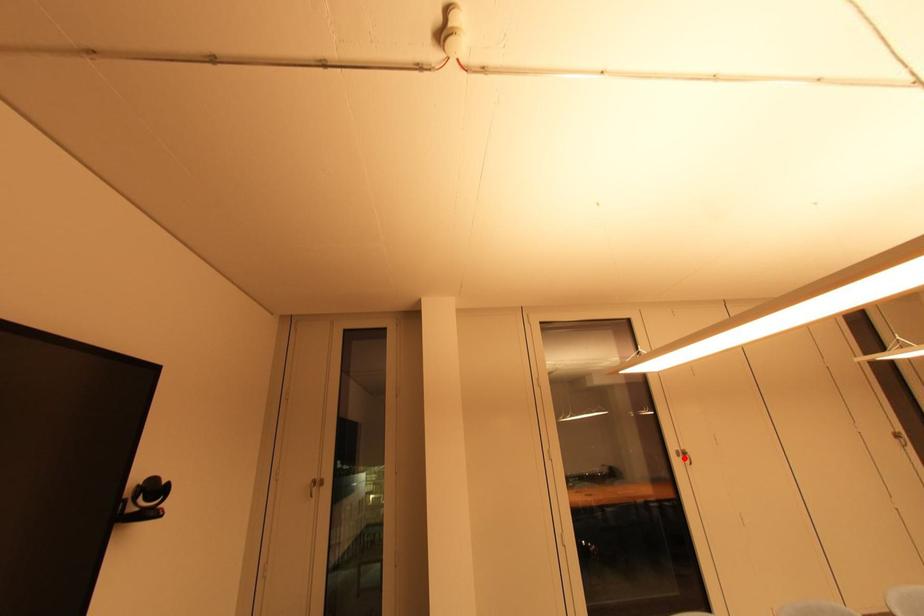
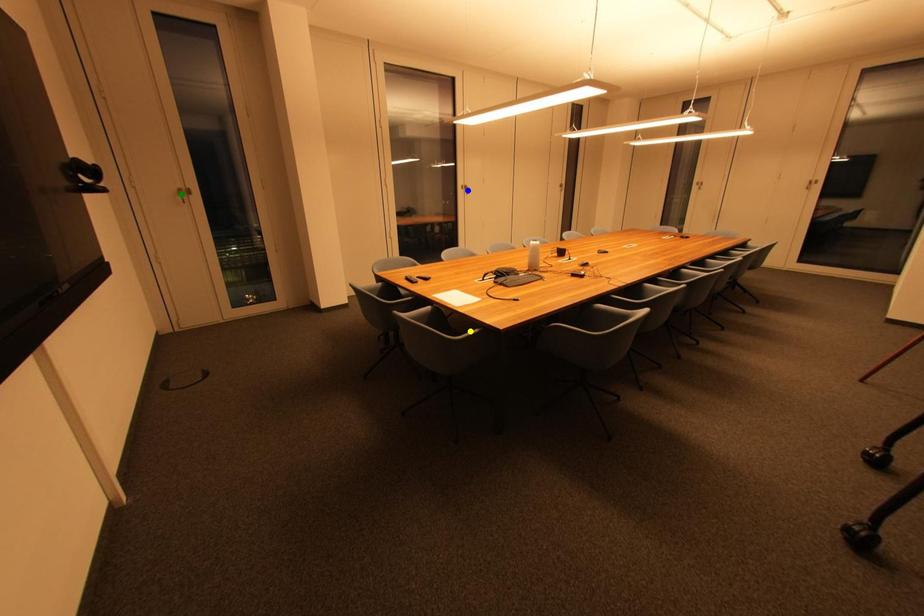
Question: I am providing you with two images of the same scene from different viewpoints. A red point is marked on the first image. You are given multiple points on the second image. In image 2, which mark is for the same physical point as the one in image 1?

Choices:
 (A) green point
 (B) yellow point
 (C) blue point

Answer: (C)